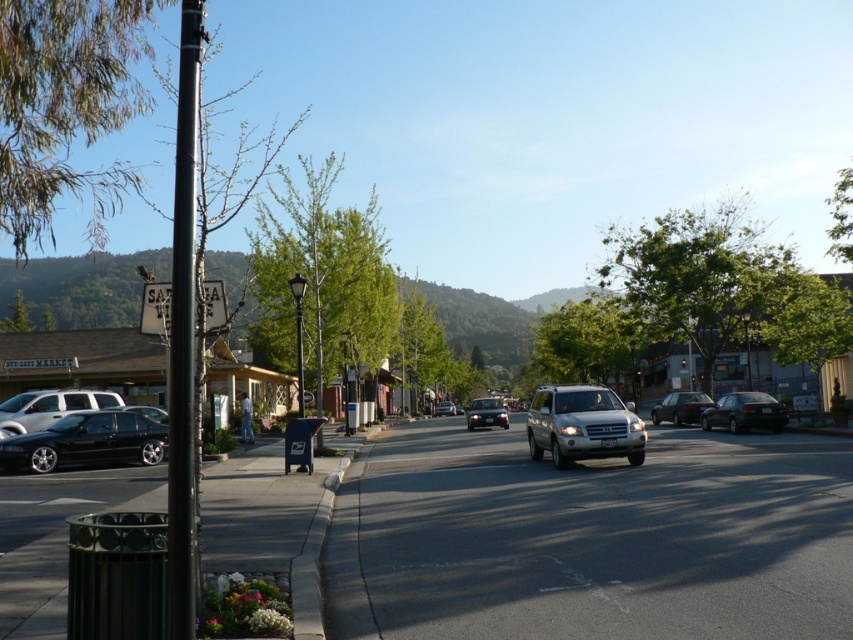
Question: Which point is closer to the camera?

Choices:
 (A) shiny black sedan at center
 (B) matte silver sedan at center

Answer: (A)

Question: Which of the following is the farthest from the observer?

Choices:
 (A) black matte sedan at center
 (B) satin silver suv at center
 (C) satin black sedan at center
 (D) matte silver sedan at center

Answer: (D)

Question: Which of the following is the closest to the observer?

Choices:
 (A) (474, 422)
 (B) (26, 449)
 (C) (677, 426)
 (D) (544, 440)

Answer: (B)

Question: Observing the image, what is the correct spatial positioning of shiny silver sedan at center in reference to satin black sedan at center?

Choices:
 (A) below
 (B) above

Answer: (A)

Question: Can you confirm if shiny black sedan at lower left is wider than black matte sedan at center?

Choices:
 (A) no
 (B) yes

Answer: (B)

Question: Can you confirm if black matte sedan at center is positioned below shiny black sedan at center?

Choices:
 (A) no
 (B) yes

Answer: (B)